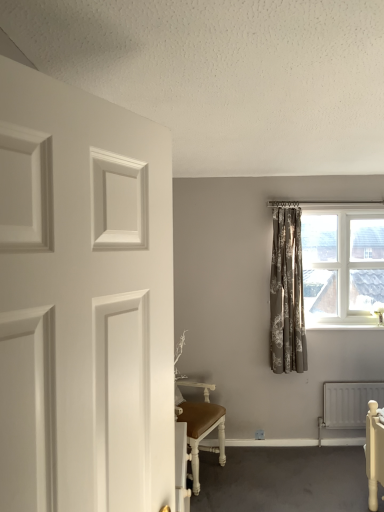
Question: Considering the positions of neutral floral fabric curtain at center-right and white metallic radiator at lower right in the image, is neutral floral fabric curtain at center-right wider or thinner than white metallic radiator at lower right?

Choices:
 (A) thin
 (B) wide

Answer: (B)

Question: Considering the positions of neutral floral fabric curtain at center-right and white metallic radiator at lower right in the image, is neutral floral fabric curtain at center-right bigger or smaller than white metallic radiator at lower right?

Choices:
 (A) small
 (B) big

Answer: (B)

Question: Which of these objects is positioned closest to the white metallic radiator at lower right?

Choices:
 (A) white textured window at upper right
 (B) white matte door at left
 (C) neutral floral fabric curtain at center-right

Answer: (C)

Question: Which is nearer to the white textured window at upper right?

Choices:
 (A) white matte door at left
 (B) neutral floral fabric curtain at center-right
 (C) white metallic radiator at lower right

Answer: (B)